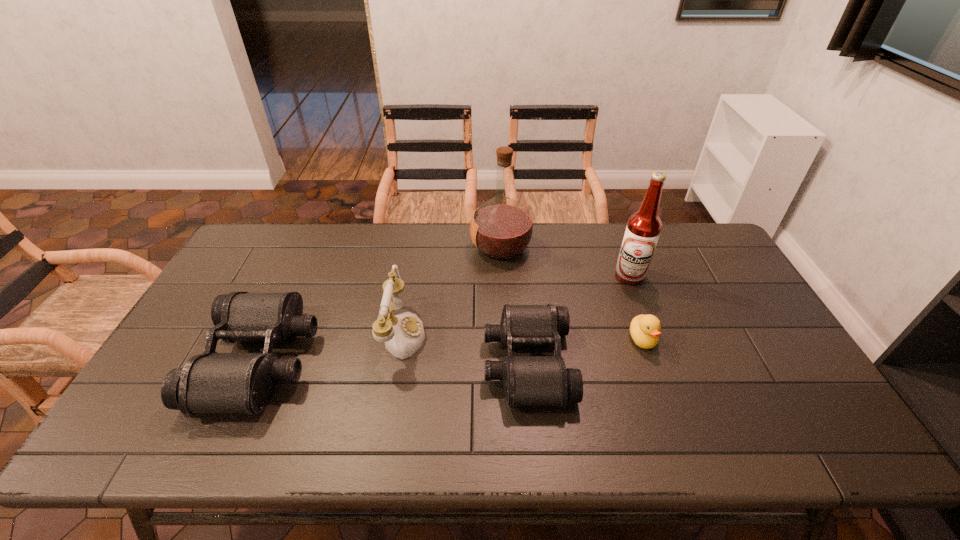
Locate an element on the screen. free space located 0.270m through the eyepieces of the shorter binoculars is located at coordinates (382, 362).

Identify the location of vacant space positioned through the eyepieces of the shorter binoculars. (443, 362).

What are the coordinates of `vacant space located on the front label of the liquor` in the screenshot? It's located at (423, 248).

Identify the location of vacant space located on the front label of the liquor. The width and height of the screenshot is (960, 540). (412, 248).

Where is `vacant point located 0.210m on the front label of the liquor`? This screenshot has height=540, width=960. vacant point located 0.210m on the front label of the liquor is located at coordinates (409, 248).

The width and height of the screenshot is (960, 540). What are the coordinates of `vacant space located on the label side of the alcohol` in the screenshot? It's located at (670, 383).

Where is `vacant region located on the dial of the telephone`? Image resolution: width=960 pixels, height=540 pixels. vacant region located on the dial of the telephone is located at coordinates (497, 333).

The image size is (960, 540). Find the location of `vacant area located on the face of the duckling`. vacant area located on the face of the duckling is located at coordinates (668, 410).

Identify the location of object that is positioned at the far edge. This screenshot has height=540, width=960. (501, 228).

The image size is (960, 540). In order to click on object that is at the left edge in this screenshot , I will do (211, 382).